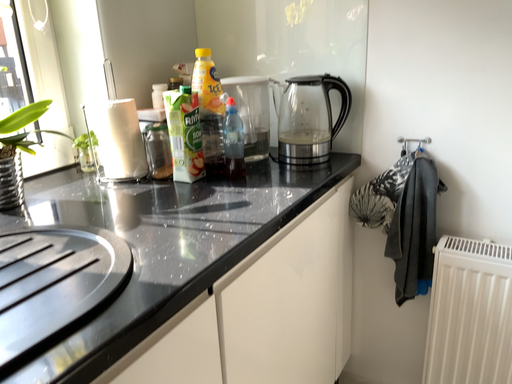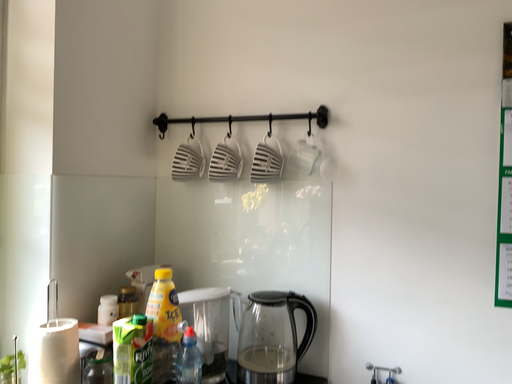
Question: Which way did the camera rotate in the video?

Choices:
 (A) rotated upward
 (B) rotated downward

Answer: (A)